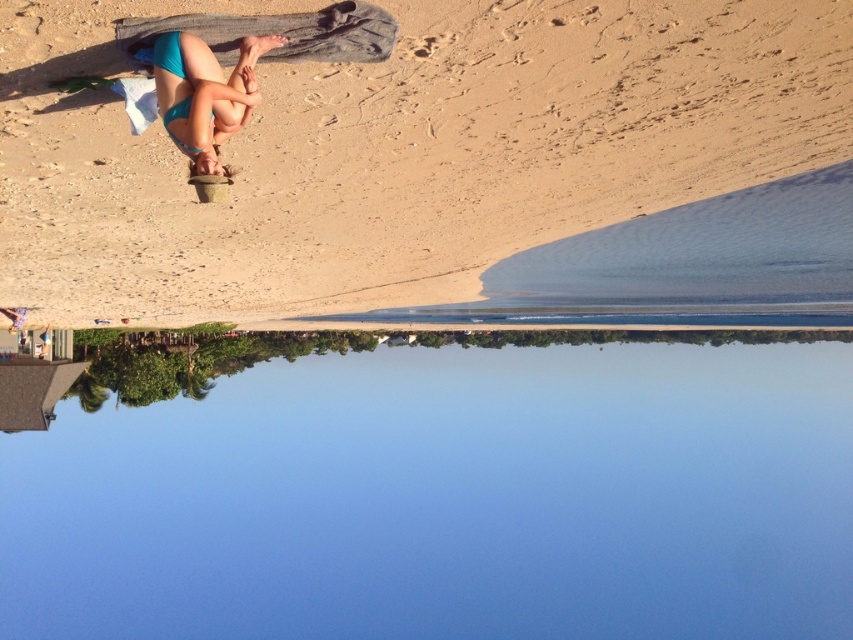
You are standing at the point marked as point (489, 86) in the beach scene. You want to walk straight towards the horizon line at the bottom of the frame. How far will you have to walk before you reach the horizon line?

The distance between point (489, 86) and the viewer is 12.92 meters. Since the horizon line is at the bottom of the frame and the viewer is facing that direction, walking straight towards the horizon line from point (489, 86) would require covering the 12.92 meters distance.

You are a photographer trying to capture the entire scene in one shot. Given that the blue water at center and the teal matte bikini bottom at upper left are both in your frame, which object would require you to adjust your camera angle more to ensure both are fully visible?

The blue water at center has a greater width than the teal matte bikini bottom at upper left, so you would need to adjust your camera angle more to accommodate the blue water at center to ensure both are fully visible.

You are a photographer standing at the edge of the beach. You want to take a photo that includes both the blue water at center and the beige sand at upper center. Which object will appear closer to the camera in the photo?

The blue water at center will appear closer to the camera because it is further to the viewer than the beige sand at upper center, meaning it is positioned nearer in the frame.